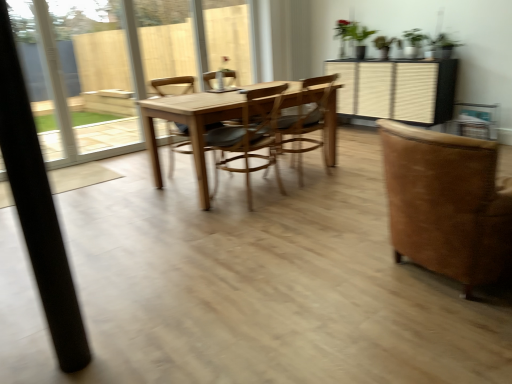
Question: Which direction should I rotate to face wooden chair at center, which ranks as the 3th chair in left-to-right order, — up or down?

Choices:
 (A) down
 (B) up

Answer: (B)

Question: From the image's perspective, does black matte pole at left appear higher than wooden chair at center, the 2th chair viewed from the right?

Choices:
 (A) yes
 (B) no

Answer: (B)

Question: Considering the relative positions of black matte pole at left and wooden chair at center, which ranks as the 3th chair in left-to-right order, in the image provided, is black matte pole at left in front of wooden chair at center, which ranks as the 3th chair in left-to-right order,?

Choices:
 (A) no
 (B) yes

Answer: (B)

Question: Can you confirm if black matte pole at left is wider than wooden chair at center, which ranks as the 3th chair in left-to-right order?

Choices:
 (A) yes
 (B) no

Answer: (B)

Question: Is black matte pole at left in contact with wooden chair at center, the 2th chair viewed from the right?

Choices:
 (A) no
 (B) yes

Answer: (A)

Question: Is black matte pole at left located outside wooden chair at center, the 2th chair viewed from the right?

Choices:
 (A) yes
 (B) no

Answer: (A)

Question: Is black matte pole at left at the right side of wooden chair at center, which ranks as the 3th chair in left-to-right order?

Choices:
 (A) yes
 (B) no

Answer: (B)

Question: Does wooden chair at center, the 4th chair in the right-to-left sequence, have a larger size compared to black matte pole at left?

Choices:
 (A) yes
 (B) no

Answer: (A)

Question: From a real-world perspective, is wooden chair at center, positioned as the first chair in left-to-right order, positioned under black matte pole at left based on gravity?

Choices:
 (A) no
 (B) yes

Answer: (B)

Question: Is wooden chair at center, the 4th chair in the right-to-left sequence, next to black matte pole at left?

Choices:
 (A) yes
 (B) no

Answer: (B)

Question: Is the depth of wooden chair at center, positioned as the first chair in left-to-right order, less than that of black matte pole at left?

Choices:
 (A) yes
 (B) no

Answer: (B)

Question: Considering the relative sizes of wooden chair at center, positioned as the first chair in left-to-right order, and black matte pole at left in the image provided, is wooden chair at center, positioned as the first chair in left-to-right order, taller than black matte pole at left?

Choices:
 (A) no
 (B) yes

Answer: (A)

Question: From the image's perspective, is wooden chair at center, the 4th chair in the right-to-left sequence, above black matte pole at left?

Choices:
 (A) yes
 (B) no

Answer: (A)

Question: Does wooden at center, arranged as the 2th chair when viewed from the left, turn towards green matte plant at upper center?

Choices:
 (A) no
 (B) yes

Answer: (A)